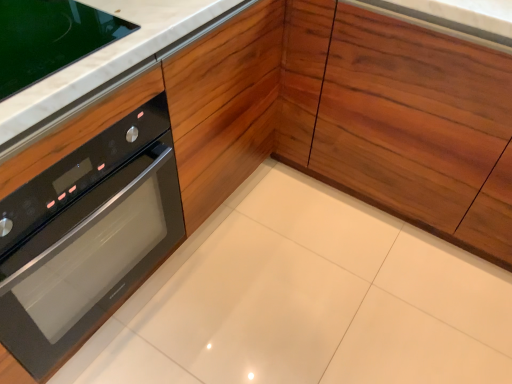
Question: Is wooden at center wider or thinner than white marble countertop at upper left?

Choices:
 (A) wide
 (B) thin

Answer: (A)

Question: From their relative heights in the image, would you say wooden at center is taller or shorter than white marble countertop at upper left?

Choices:
 (A) tall
 (B) short

Answer: (A)

Question: Which object is positioned closest to the black glass oven at left?

Choices:
 (A) white marble countertop at upper left
 (B) wooden at center

Answer: (A)

Question: Considering the real-world distances, which object is farthest from the white marble countertop at upper left?

Choices:
 (A) wooden at center
 (B) black glass oven at left

Answer: (A)